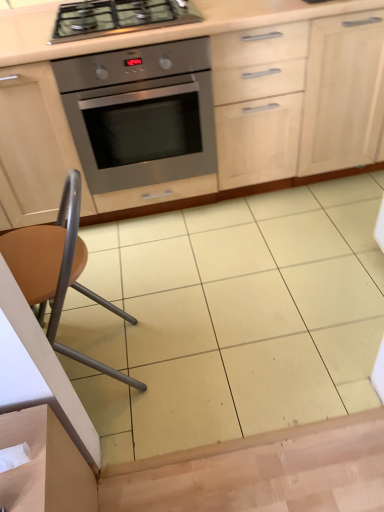
Question: From a real-world perspective, is stainless steel oven at center below matte wood cabinetry at center?

Choices:
 (A) no
 (B) yes

Answer: (B)

Question: From the image's perspective, is stainless steel oven at center above matte wood cabinetry at center?

Choices:
 (A) yes
 (B) no

Answer: (B)

Question: Is there a large distance between stainless steel oven at center and matte wood cabinetry at center?

Choices:
 (A) no
 (B) yes

Answer: (A)

Question: Can you confirm if stainless steel oven at center is positioned to the right of matte wood cabinetry at center?

Choices:
 (A) no
 (B) yes

Answer: (A)

Question: Is stainless steel oven at center wider than matte wood cabinetry at center?

Choices:
 (A) yes
 (B) no

Answer: (A)

Question: In terms of height, does matte wood cabinetry at center look taller or shorter compared to stainless steel gas stove at upper center?

Choices:
 (A) short
 (B) tall

Answer: (B)

Question: From a real-world perspective, is matte wood cabinetry at center above or below stainless steel gas stove at upper center?

Choices:
 (A) above
 (B) below

Answer: (B)

Question: Does point (289, 25) appear closer or farther from the camera than point (112, 8)?

Choices:
 (A) farther
 (B) closer

Answer: (A)

Question: Considering the positions of matte wood cabinetry at center and stainless steel gas stove at upper center in the image, is matte wood cabinetry at center wider or thinner than stainless steel gas stove at upper center?

Choices:
 (A) wide
 (B) thin

Answer: (A)

Question: Is brown matte chair at lower left bigger or smaller than stainless steel gas stove at upper center?

Choices:
 (A) big
 (B) small

Answer: (A)

Question: In the image, is brown matte chair at lower left positioned in front of or behind stainless steel gas stove at upper center?

Choices:
 (A) behind
 (B) front

Answer: (B)

Question: In terms of width, does brown matte chair at lower left look wider or thinner when compared to stainless steel gas stove at upper center?

Choices:
 (A) thin
 (B) wide

Answer: (A)

Question: Which is correct: brown matte chair at lower left is inside stainless steel gas stove at upper center, or outside of it?

Choices:
 (A) outside
 (B) inside

Answer: (A)

Question: In terms of height, does brown matte chair at lower left look taller or shorter compared to stainless steel oven at center?

Choices:
 (A) short
 (B) tall

Answer: (B)

Question: From the image's perspective, relative to stainless steel oven at center, is brown matte chair at lower left above or below?

Choices:
 (A) above
 (B) below

Answer: (B)